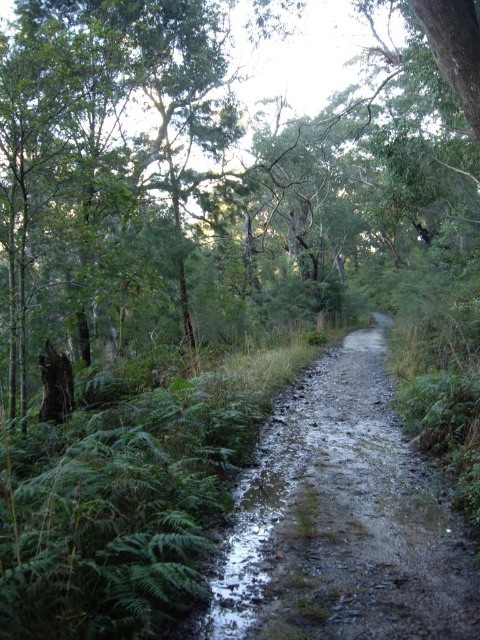
Can you confirm if brown rough tree at center is thinner than muddy gravel path at center?

No.

In the scene shown: Is brown rough tree at center shorter than muddy gravel path at center?

Incorrect, brown rough tree at center's height does not fall short of muddy gravel path at center's.

You are a GUI agent. You are given a task and a screenshot of the screen. Output one action in this format:
    pyautogui.click(x=<x>, y=<y>)
    Task: Click on the brown rough tree at center
    
    Given the screenshot: What is the action you would take?
    pyautogui.click(x=215, y=176)